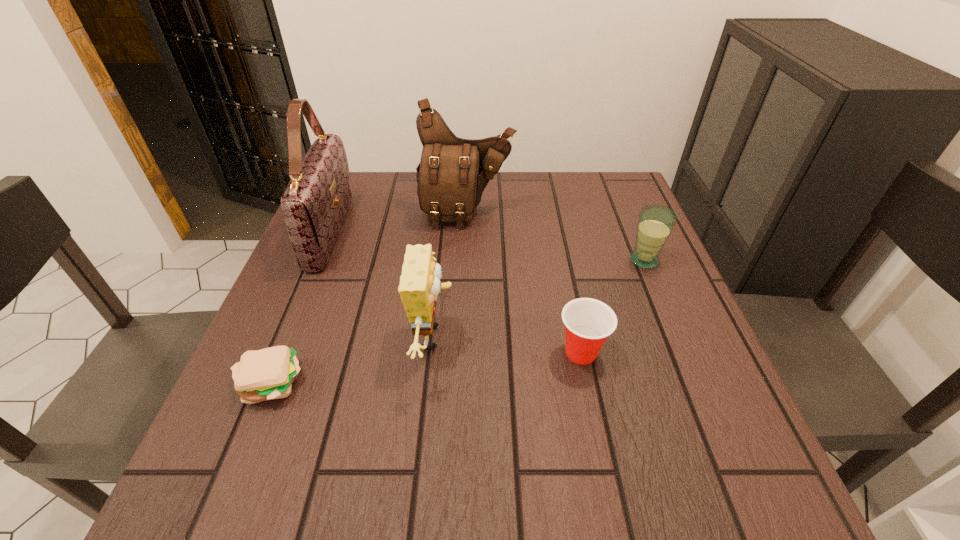
Where is `unoccupied area between the sponge and the glass`? This screenshot has height=540, width=960. unoccupied area between the sponge and the glass is located at coordinates [x=539, y=299].

Where is `empty location between the fifth tallest object and the patty`? Image resolution: width=960 pixels, height=540 pixels. empty location between the fifth tallest object and the patty is located at coordinates (425, 367).

This screenshot has height=540, width=960. Identify the location of vacant region between the cup and the shortest object. (425, 367).

At what (x,y) coordinates should I click in order to perform the action: click on free space between the shoulder bag and the shortest object. Please return your answer as a coordinate pair (x, y). Looking at the image, I should click on (369, 298).

Locate an element on the screen. free space between the second object from right to left and the fifth shortest object is located at coordinates (524, 283).

Where is `vacant area between the fourth tallest object and the third tallest object`? This screenshot has height=540, width=960. vacant area between the fourth tallest object and the third tallest object is located at coordinates tap(539, 299).

Find the location of a particular element. The height and width of the screenshot is (540, 960). free space between the shoulder bag and the handbag is located at coordinates click(398, 222).

Where is `the fourth closest object to the cup`? the fourth closest object to the cup is located at coordinates (266, 374).

The width and height of the screenshot is (960, 540). What are the coordinates of `object that stands as the closest to the glass` in the screenshot? It's located at (588, 322).

Where is `vacant space that satisfies the following two spatial constraints: 1. on the front of the handbag with the clasp; 2. on the back side of the rightmost object`? vacant space that satisfies the following two spatial constraints: 1. on the front of the handbag with the clasp; 2. on the back side of the rightmost object is located at coordinates (319, 260).